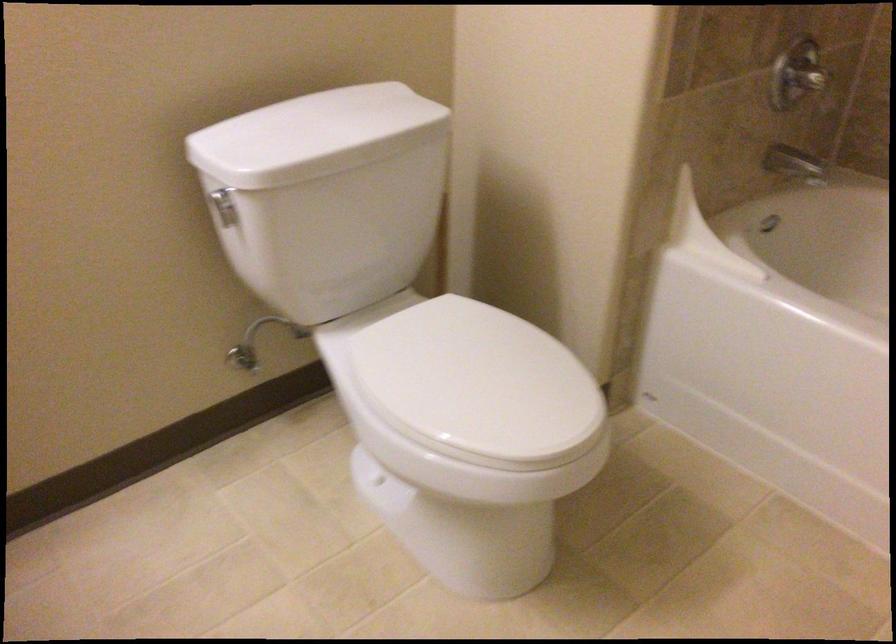
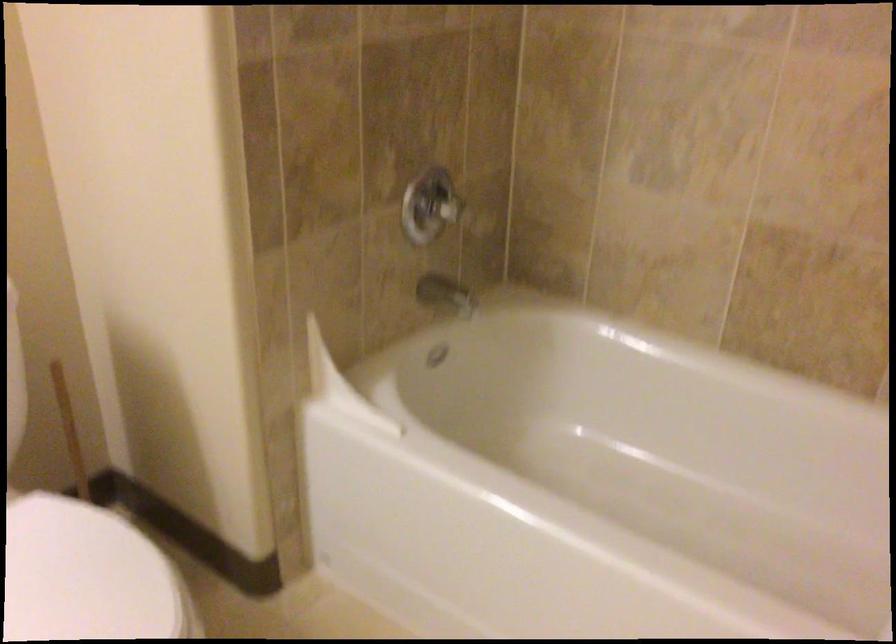
In the second image, find the point that corresponds to pixel 440 259 in the first image.

(72, 438)